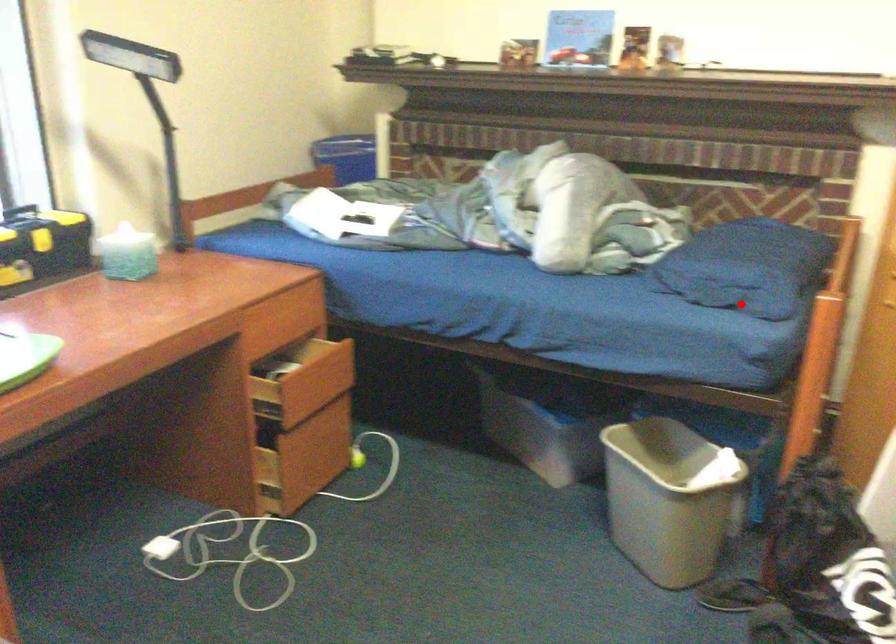
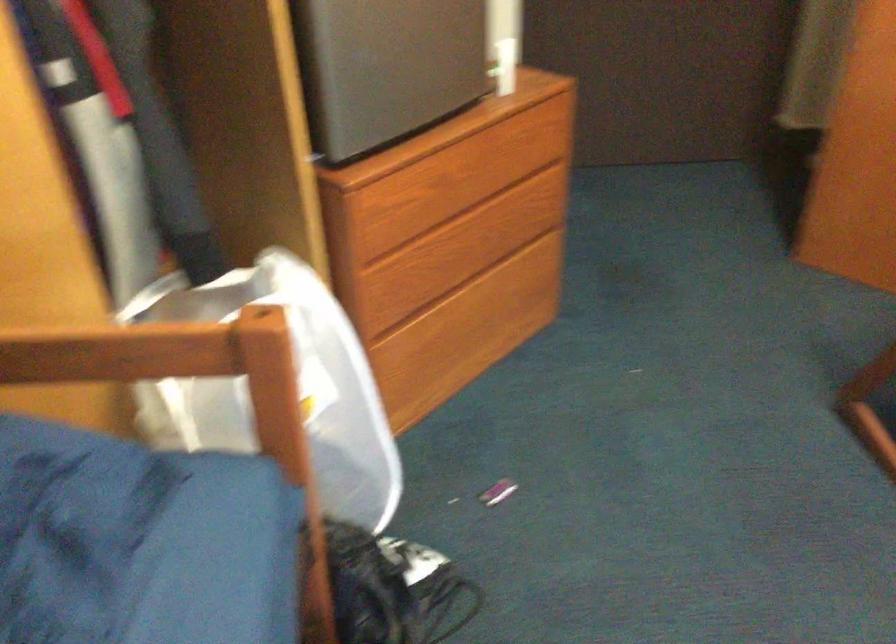
Question: I am providing you with two images of the same scene from different viewpoints. In image1, a red point is highlighted. Considering the same 3D point in image2, which of the following is correct?

Choices:
 (A) It is closer
 (B) It is farther

Answer: (A)